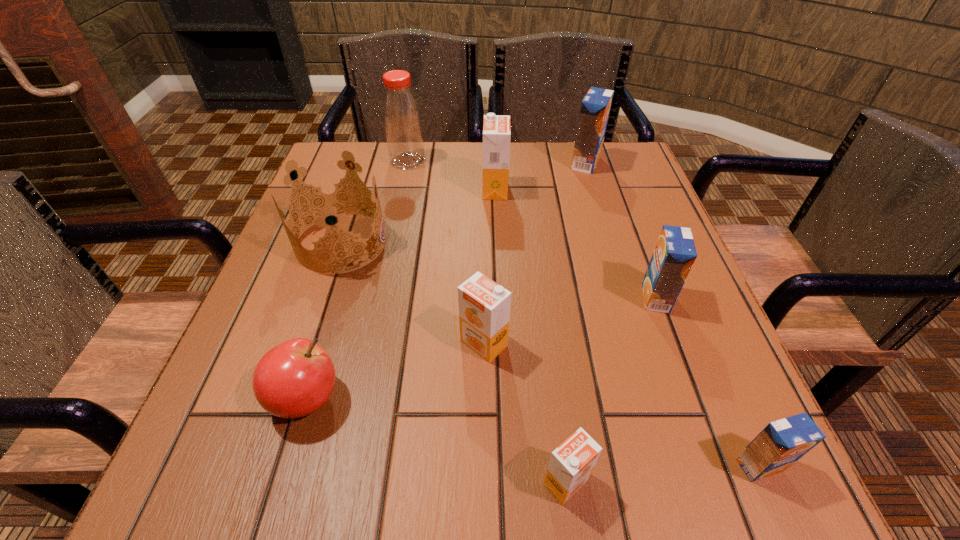
You are a GUI agent. You are given a task and a screenshot of the screen. Output one action in this format:
    pyautogui.click(x=<x>, y=<y>)
    Task: Click on the vacant area that lies between the smallest blue orange_juice and the third nearest orange juice
    
    Given the screenshot: What is the action you would take?
    pyautogui.click(x=621, y=404)

Where is `vacant space in between the crown and the farthest orange orange juice`? vacant space in between the crown and the farthest orange orange juice is located at coordinates (419, 216).

Image resolution: width=960 pixels, height=540 pixels. Find the location of `the sixth closest object to the nearest blue orange_juice`. the sixth closest object to the nearest blue orange_juice is located at coordinates (496, 128).

Find the location of a particular element. The width and height of the screenshot is (960, 540). object that is the third closest one to the rightmost orange orange juice is located at coordinates (295, 378).

Identify the location of orange juice that is the second closest to the second farthest orange orange juice. The image size is (960, 540). (674, 255).

Identify which orange juice is the third nearest to the second farthest orange orange juice. Please provide its 2D coordinates. Your answer should be formatted as a tuple, i.e. [(x, y)], where the tuple contains the x and y coordinates of a point satisfying the conditions above.

[(781, 443)]

Locate which blue orange_juice ranks in proximity to the nearest blue orange_juice. Please provide its 2D coordinates. Your answer should be formatted as a tuple, i.e. [(x, y)], where the tuple contains the x and y coordinates of a point satisfying the conditions above.

[(674, 255)]

You are a GUI agent. You are given a task and a screenshot of the screen. Output one action in this format:
    pyautogui.click(x=<x>, y=<y>)
    Task: Click on the blue orange_juice that is the third closest to the red bottle
    The width and height of the screenshot is (960, 540).
    Given the screenshot: What is the action you would take?
    pyautogui.click(x=781, y=443)

Identify the location of orange orange juice that stands as the closest to the smallest blue orange_juice. (571, 464).

Locate which orange orange juice is the second closest to the fourth nearest orange juice. Please provide its 2D coordinates. Your answer should be formatted as a tuple, i.e. [(x, y)], where the tuple contains the x and y coordinates of a point satisfying the conditions above.

[(571, 464)]